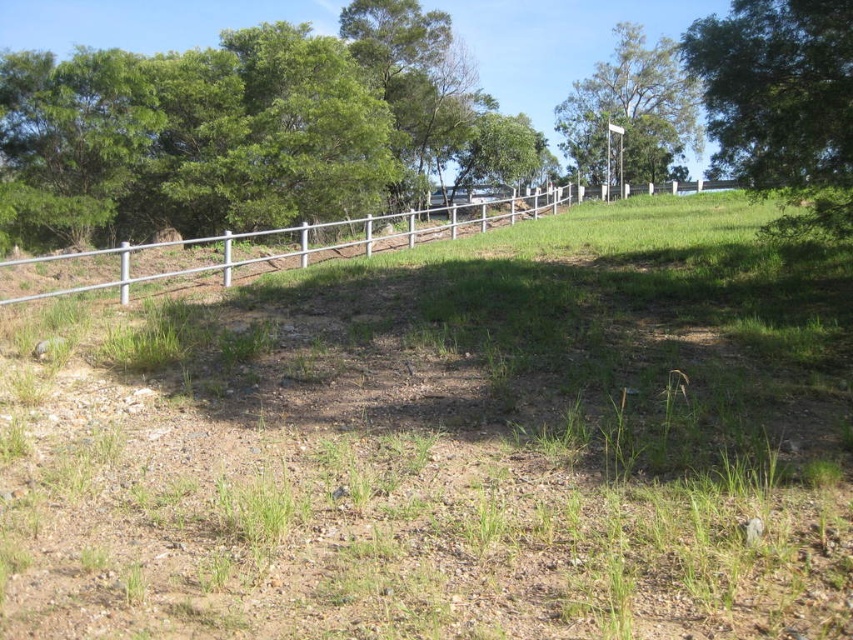
You are standing in the grassy area and want to take a photo of the two green leafy trees. Which tree, the green leafy tree at upper right or the green leafy tree at upper center, will appear closer to you in the photo?

The green leafy tree at upper right will appear closer to you in the photo because it is in front of the green leafy tree at upper center.

You are a landscape architect designing a new garden. You need to place a decorative statue that requires a space wider than the silver metallic fence at upper center. Can the green leafy tree at upper right provide enough space for this statue?

The green leafy tree at upper right is wider than the silver metallic fence at upper center, so the space under the green leafy tree at upper right can accommodate the statue requiring more width than the silver metallic fence at upper center.